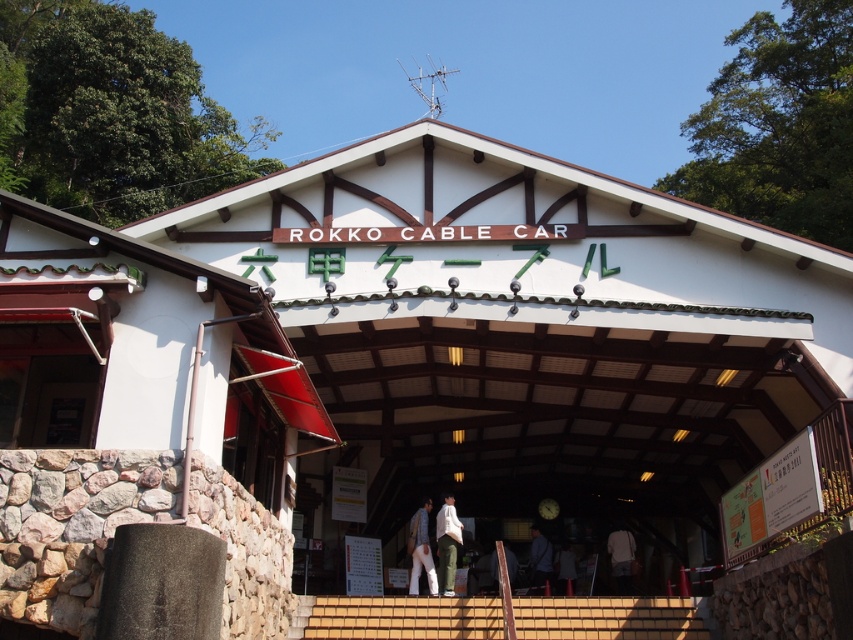
You are standing in front of the Rokko Cable Car station entrance. You notice a point marked at coordinates (447, 545). According to the image, what object is located at that point?

The point at coordinates (447, 545) is on green cotton pants at center.

You are standing in front of the Rokko Cable Car station entrance and notice two items hanging from the ceiling grid. The green cotton pants at center and the white fabric at center. Which one is shorter?

The green cotton pants at center is shorter than the white fabric at center.